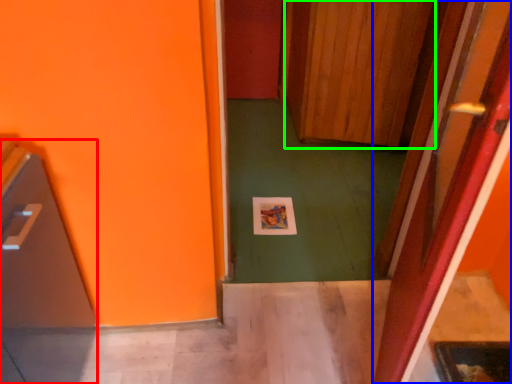
Question: Based on their relative distances, which object is farther from appliance (highlighted by a red box)? Choose from door (highlighted by a blue box) and door (highlighted by a green box).

Choices:
 (A) door
 (B) door

Answer: (B)